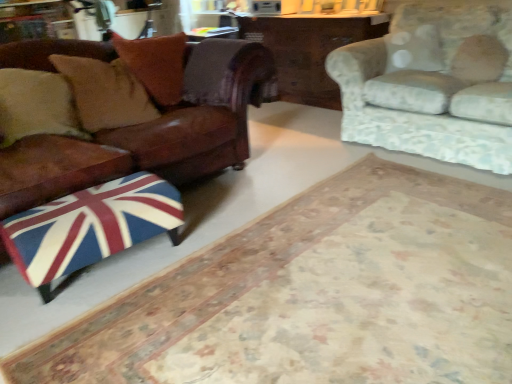
Identify the location of free space above union jack fabric ottoman at lower left (from a real-world perspective). The width and height of the screenshot is (512, 384). (59, 202).